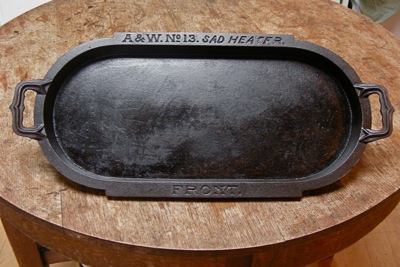
Locate an element on the screen. wooden table is located at coordinates (36, 189), (213, 13), (365, 54), (30, 43).